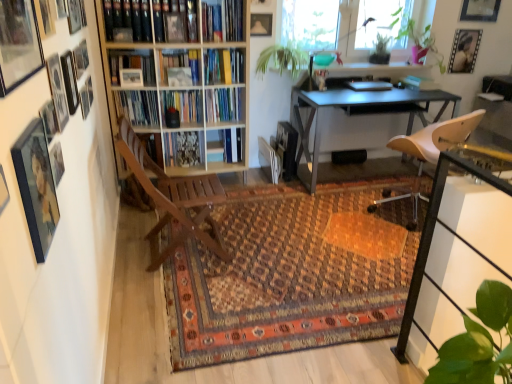
Locate an element on the screen. spots to the right of brown wooden chair at center, which is counted as the first chair, starting from the left is located at coordinates (244, 248).